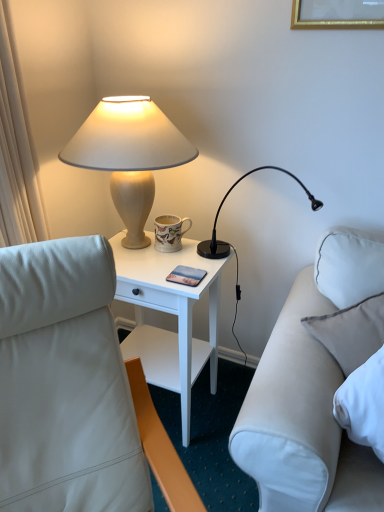
What is the approximate width of black plastic desk lamp at upper right, acting as the 1th lamp starting from the right?

The width of black plastic desk lamp at upper right, acting as the 1th lamp starting from the right, is 16.51 inches.

The width and height of the screenshot is (384, 512). Describe the element at coordinates (129, 155) in the screenshot. I see `matte beige lamp at upper left, the first lamp viewed from the left` at that location.

Locate an element on the screen. The image size is (384, 512). black plastic desk lamp at upper right, acting as the 1th lamp starting from the right is located at coordinates (232, 245).

Looking at this image, can you see black plastic desk lamp at upper right, the 2th lamp positioned from the left, touching white leather studio couch at right?

There is a gap between black plastic desk lamp at upper right, the 2th lamp positioned from the left, and white leather studio couch at right.

Is black plastic desk lamp at upper right, the 2th lamp positioned from the left, taller than white leather studio couch at right?

No.

From the image's perspective, relative to white wood nightstand at center, is matte beige lamp at upper left, the first lamp viewed from the left, above or below?

Based on their image positions, matte beige lamp at upper left, the first lamp viewed from the left, is located above white wood nightstand at center.

From a real-world perspective, between matte beige lamp at upper left, the 2th lamp in the right-to-left sequence, and white wood nightstand at center, who is vertically higher?

In real-world perspective, matte beige lamp at upper left, the 2th lamp in the right-to-left sequence, is above.

This screenshot has height=512, width=384. I want to click on nightstand lying behind the matte beige lamp at upper left, the 2th lamp in the right-to-left sequence, so click(x=170, y=313).

Considering the sizes of white leather studio couch at right and matte beige lamp at upper left, the first lamp viewed from the left, in the image, is white leather studio couch at right wider or thinner than matte beige lamp at upper left, the first lamp viewed from the left,?

Clearly, white leather studio couch at right has less width compared to matte beige lamp at upper left, the first lamp viewed from the left.

How many degrees apart are the facing directions of white leather studio couch at right and matte beige lamp at upper left, the 2th lamp in the right-to-left sequence?

15.4 degrees separate the facing orientations of white leather studio couch at right and matte beige lamp at upper left, the 2th lamp in the right-to-left sequence.

Between white leather studio couch at right and matte beige lamp at upper left, the 2th lamp in the right-to-left sequence, which one appears on the right side from the viewer's perspective?

Positioned to the right is white leather studio couch at right.

Considering the points (283, 494) and (69, 155), which point is behind, point (283, 494) or point (69, 155)?

The point (69, 155) is behind.

Between white leather studio couch at right and black plastic desk lamp at upper right, the 2th lamp positioned from the left, which one appears on the right side from the viewer's perspective?

Positioned to the right is white leather studio couch at right.

From the image's perspective, relative to black plastic desk lamp at upper right, the 2th lamp positioned from the left, is white leather studio couch at right above or below?

white leather studio couch at right is situated lower than black plastic desk lamp at upper right, the 2th lamp positioned from the left, in the image.

Which is behind, white leather studio couch at right or black plastic desk lamp at upper right, the 2th lamp positioned from the left?

black plastic desk lamp at upper right, the 2th lamp positioned from the left, is further from the camera.

Which of these two, white leather studio couch at right or black plastic desk lamp at upper right, the 2th lamp positioned from the left, is wider?

With larger width is black plastic desk lamp at upper right, the 2th lamp positioned from the left.

Are white wood nightstand at center and matte beige lamp at upper left, the 2th lamp in the right-to-left sequence, located far from each other?

No, white wood nightstand at center is in close proximity to matte beige lamp at upper left, the 2th lamp in the right-to-left sequence.

Who is more distant, white wood nightstand at center or matte beige lamp at upper left, the first lamp viewed from the left?

white wood nightstand at center is further away from the camera.

Is white wood nightstand at center to the right of matte beige lamp at upper left, the 2th lamp in the right-to-left sequence, from the viewer's perspective?

Yes.

From the image's perspective, between white wood nightstand at center and matte beige lamp at upper left, the 2th lamp in the right-to-left sequence, which one is located above?

matte beige lamp at upper left, the 2th lamp in the right-to-left sequence.

From a real-world perspective, which object stands above the other?

black plastic desk lamp at upper right, acting as the 1th lamp starting from the right, is physically above.

Who is smaller, white wood nightstand at center or black plastic desk lamp at upper right, the 2th lamp positioned from the left?

With smaller size is black plastic desk lamp at upper right, the 2th lamp positioned from the left.

This screenshot has width=384, height=512. I want to click on lamp on the right of white wood nightstand at center, so click(232, 245).

I want to click on lamp above the black plastic desk lamp at upper right, the 2th lamp positioned from the left (from the image's perspective), so click(129, 155).

Does matte beige lamp at upper left, the first lamp viewed from the left, have a lesser width compared to black plastic desk lamp at upper right, the 2th lamp positioned from the left?

Correct, the width of matte beige lamp at upper left, the first lamp viewed from the left, is less than that of black plastic desk lamp at upper right, the 2th lamp positioned from the left.

Considering the relative positions of matte beige lamp at upper left, the first lamp viewed from the left, and black plastic desk lamp at upper right, the 2th lamp positioned from the left, in the image provided, is matte beige lamp at upper left, the first lamp viewed from the left, behind black plastic desk lamp at upper right, the 2th lamp positioned from the left,?

No, matte beige lamp at upper left, the first lamp viewed from the left, is closer to the camera.

You are a GUI agent. You are given a task and a screenshot of the screen. Output one action in this format:
    pyautogui.click(x=<x>, y=<y>)
    Task: Click on the studio couch below the black plastic desk lamp at upper right, acting as the 1th lamp starting from the right (from the image's perspective)
    Image resolution: width=384 pixels, height=512 pixels.
    Given the screenshot: What is the action you would take?
    pyautogui.click(x=310, y=392)

In the image, there is a matte beige lamp at upper left, the 2th lamp in the right-to-left sequence. At what (x,y) coordinates should I click in order to perform the action: click on nightstand below it (from a real-world perspective). Please return your answer as a coordinate pair (x, y). This screenshot has width=384, height=512. Looking at the image, I should click on (170, 313).

When comparing their distances from matte beige lamp at upper left, the first lamp viewed from the left, does black plastic desk lamp at upper right, the 2th lamp positioned from the left, or white leather studio couch at right seem further?

white leather studio couch at right.

Estimate the real-world distances between objects in this image. Which object is further from white wood nightstand at center, matte beige lamp at upper left, the 2th lamp in the right-to-left sequence, or black plastic desk lamp at upper right, the 2th lamp positioned from the left?

matte beige lamp at upper left, the 2th lamp in the right-to-left sequence, is further to white wood nightstand at center.

Based on their spatial positions, is white wood nightstand at center or black plastic desk lamp at upper right, the 2th lamp positioned from the left, closer to matte beige lamp at upper left, the first lamp viewed from the left?

white wood nightstand at center is positioned closer to the anchor matte beige lamp at upper left, the first lamp viewed from the left.

When comparing their distances from black plastic desk lamp at upper right, acting as the 1th lamp starting from the right, does matte beige lamp at upper left, the 2th lamp in the right-to-left sequence, or white leather studio couch at right seem further?

white leather studio couch at right.

When comparing their distances from white wood nightstand at center, does black plastic desk lamp at upper right, acting as the 1th lamp starting from the right, or white leather studio couch at right seem further?

white leather studio couch at right lies further to white wood nightstand at center than the other object.

From the image, which object appears to be nearer to white leather studio couch at right, black plastic desk lamp at upper right, the 2th lamp positioned from the left, or white wood nightstand at center?

Among the two, white wood nightstand at center is located nearer to white leather studio couch at right.

When comparing their distances from white leather studio couch at right, does white wood nightstand at center or black plastic desk lamp at upper right, the 2th lamp positioned from the left, seem further?

Based on the image, black plastic desk lamp at upper right, the 2th lamp positioned from the left, appears to be further to white leather studio couch at right.

Considering their positions, is white wood nightstand at center positioned further to black plastic desk lamp at upper right, acting as the 1th lamp starting from the right, than white leather studio couch at right?

white leather studio couch at right is further to black plastic desk lamp at upper right, acting as the 1th lamp starting from the right.

At what (x,y) coordinates should I click in order to perform the action: click on lamp between white wood nightstand at center and white leather studio couch at right. Please return your answer as a coordinate pair (x, y). This screenshot has width=384, height=512. Looking at the image, I should click on (232, 245).

The height and width of the screenshot is (512, 384). What are the coordinates of `lamp between matte beige lamp at upper left, the 2th lamp in the right-to-left sequence, and white wood nightstand at center in the up-down direction` in the screenshot? It's located at (232, 245).

Locate an element on the screen. The image size is (384, 512). nightstand located between matte beige lamp at upper left, the 2th lamp in the right-to-left sequence, and white leather studio couch at right in the left-right direction is located at coordinates (170, 313).

This screenshot has width=384, height=512. I want to click on lamp between matte beige lamp at upper left, the 2th lamp in the right-to-left sequence, and white leather studio couch at right from left to right, so click(x=232, y=245).